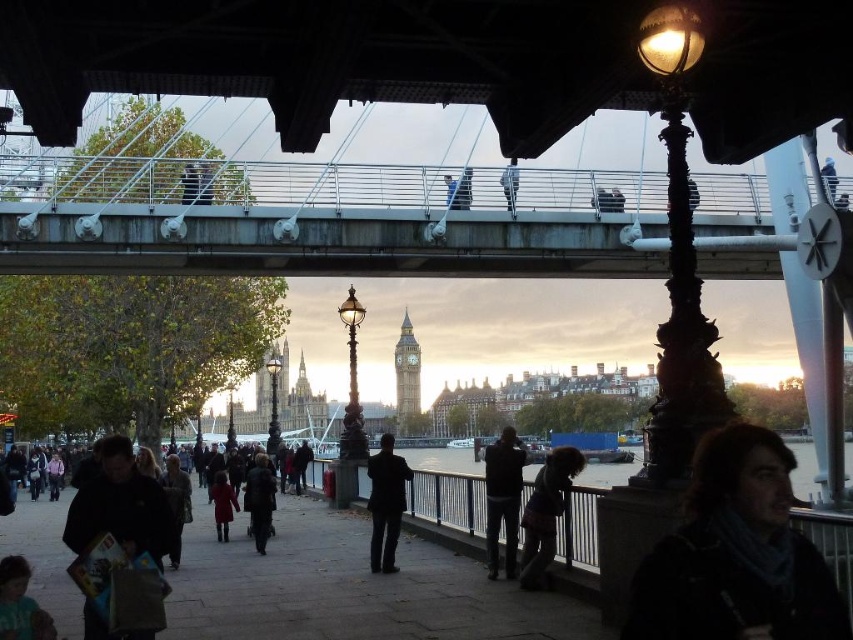
You are a tourist standing on the riverside walkway and want to take a photo of the dark blue jacket at center while also including the dark matte scarf at lower right in the frame. Which object should you focus on first to ensure both are in the photo?

You should focus on the dark blue jacket at center first because the dark matte scarf at lower right is closer to the viewer, so adjusting the camera to include both would require ensuring the scarf is within the frame while the jacket is in focus.

You are a tourist standing on the riverside walkway and want to take a photo of the dark blue jacket at center and the dark matte scarf at lower right. Which object should you frame first in your camera viewfinder to ensure both are in the shot?

You should frame the dark blue jacket at center first because the dark matte scarf at lower right is to the right of it, so positioning the jacket centrally will allow the scarf to be included to its right side.

You are standing at the riverside scene with Big Ben in the background. You see a point at coordinates [259,499]. What object is this point located on?

The point at coordinates [259,499] is located on the dark gray jacket at center.